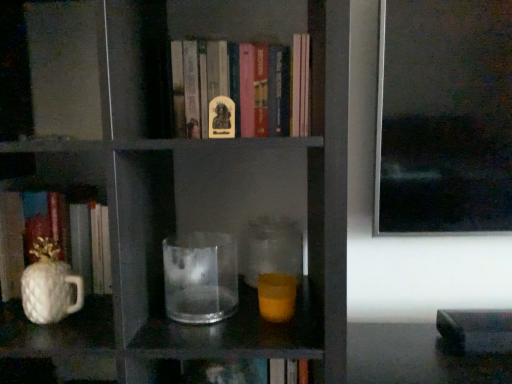
This screenshot has height=384, width=512. Describe the element at coordinates (272, 249) in the screenshot. I see `transparent glass jar at center` at that location.

At what (x,y) coordinates should I click in order to perform the action: click on transparent glass at center. Please return your answer as a coordinate pair (x, y). Looking at the image, I should click on (200, 277).

Where is `white glossy pineapple-shaped mug at left`? This screenshot has width=512, height=384. white glossy pineapple-shaped mug at left is located at coordinates (49, 285).

Image resolution: width=512 pixels, height=384 pixels. I want to click on translucent glass candle at center, so click(277, 296).

Considering the sizes of objects transparent glass at center and hardcover book at center, the second book in the left-to-right sequence, in the image provided, who is shorter, transparent glass at center or hardcover book at center, the second book in the left-to-right sequence,?

transparent glass at center.

Relative to hardcover book at center, the second book in the left-to-right sequence, is transparent glass at center in front or behind?

Visually, transparent glass at center is located in front of hardcover book at center, the second book in the left-to-right sequence.

Is transparent glass at center facing away from hardcover book at center, the second book in the left-to-right sequence?

No, transparent glass at center is not facing the opposite direction of hardcover book at center, the second book in the left-to-right sequence.

Is point (59, 218) closer to viewer compared to point (177, 308)?

No.

In the image, is white glossy pineapple-shaped object at left, which is counted as the second book, starting from the right, on the left side or the right side of transparent glass at center?

Clearly, white glossy pineapple-shaped object at left, which is counted as the second book, starting from the right, is on the left of transparent glass at center in the image.

Considering the sizes of objects white glossy pineapple-shaped object at left, which is counted as the 2th book, starting from the top, and transparent glass at center in the image provided, who is thinner, white glossy pineapple-shaped object at left, which is counted as the 2th book, starting from the top, or transparent glass at center?

With smaller width is transparent glass at center.

From the image's perspective, which book is the 1st one above the transparent glass jar at center? Please provide its 2D coordinates.

[(28, 232)]

From a real-world perspective, is white glossy pineapple-shaped object at left, the 1th book viewed from the left, above or below transparent glass jar at center?

In terms of real-world spatial position, white glossy pineapple-shaped object at left, the 1th book viewed from the left, is above transparent glass jar at center.

Is white glossy pineapple-shaped object at left, marked as the first book in a bottom-to-top arrangement, situated inside transparent glass jar at center or outside?

white glossy pineapple-shaped object at left, marked as the first book in a bottom-to-top arrangement, exists outside the volume of transparent glass jar at center.

Which object is wider, white glossy pineapple-shaped object at left, marked as the first book in a bottom-to-top arrangement, or transparent glass jar at center?

With larger width is white glossy pineapple-shaped object at left, marked as the first book in a bottom-to-top arrangement.

Which object is closer to the camera taking this photo, hardcover book at center, the second book in the left-to-right sequence, or white glossy pineapple-shaped object at left, which is counted as the second book, starting from the right?

hardcover book at center, the second book in the left-to-right sequence.

Can you confirm if hardcover book at center, marked as the 2th book in a bottom-to-top arrangement, is bigger than white glossy pineapple-shaped object at left, the 1th book viewed from the left?

Yes, hardcover book at center, marked as the 2th book in a bottom-to-top arrangement, is bigger than white glossy pineapple-shaped object at left, the 1th book viewed from the left.

Is hardcover book at center, the second book in the left-to-right sequence, aimed at white glossy pineapple-shaped object at left, which is counted as the second book, starting from the right?

No, hardcover book at center, the second book in the left-to-right sequence, is not oriented towards white glossy pineapple-shaped object at left, which is counted as the second book, starting from the right.

Is translucent glass candle at center facing towards white glossy pineapple-shaped mug at left?

No, translucent glass candle at center is not facing towards white glossy pineapple-shaped mug at left.

Is translucent glass candle at center to the left of white glossy pineapple-shaped mug at left from the viewer's perspective?

In fact, translucent glass candle at center is to the right of white glossy pineapple-shaped mug at left.

Who is smaller, translucent glass candle at center or white glossy pineapple-shaped mug at left?

Smaller between the two is translucent glass candle at center.

Is translucent glass candle at center inside the boundaries of white glossy pineapple-shaped mug at left, or outside?

The correct answer is: outside.

Is hardcover book at center, the second book in the left-to-right sequence, facing away from transparent glass jar at center?

hardcover book at center, the second book in the left-to-right sequence, is not turned away from transparent glass jar at center.

Which of these two, hardcover book at center, the second book in the left-to-right sequence, or transparent glass jar at center, stands taller?

Standing taller between the two is hardcover book at center, the second book in the left-to-right sequence.

The width and height of the screenshot is (512, 384). What are the coordinates of `glass jar located behind the hardcover book at center, the second book in the left-to-right sequence` in the screenshot? It's located at (272, 249).

Considering the positions of objects hardcover book at center, the 1th book viewed from the top, and transparent glass jar at center in the image provided, who is more to the right, hardcover book at center, the 1th book viewed from the top, or transparent glass jar at center?

From the viewer's perspective, transparent glass jar at center appears more on the right side.

Looking at this image, from the image's perspective, which object appears higher, white glossy pineapple-shaped mug at left or white glossy pineapple-shaped object at left, which is counted as the second book, starting from the right?

white glossy pineapple-shaped object at left, which is counted as the second book, starting from the right, appears higher in the image.

How many degrees apart are the facing directions of white glossy pineapple-shaped mug at left and white glossy pineapple-shaped object at left, the 1th book viewed from the left?

The angle between the facing direction of white glossy pineapple-shaped mug at left and the facing direction of white glossy pineapple-shaped object at left, the 1th book viewed from the left, is 0.000394 degrees.

The width and height of the screenshot is (512, 384). In order to click on book on the left of white glossy pineapple-shaped mug at left in this screenshot , I will do `click(28, 232)`.

Can you confirm if white glossy pineapple-shaped mug at left is smaller than white glossy pineapple-shaped object at left, which is counted as the second book, starting from the right?

Yes.

Find the location of `jug in front of the hardcover book at center, positioned as the 1th book in right-to-left order`. jug in front of the hardcover book at center, positioned as the 1th book in right-to-left order is located at coordinates (200, 277).

This screenshot has height=384, width=512. What are the coordinates of `jug lying below the white glossy pineapple-shaped object at left, which is counted as the second book, starting from the right (from the image's perspective)` in the screenshot? It's located at (200, 277).

Based on their spatial positions, is transparent glass at center or hardcover book at center, marked as the 2th book in a bottom-to-top arrangement, closer to transparent glass jar at center?

Among the two, transparent glass at center is located nearer to transparent glass jar at center.

Considering their positions, is translucent glass candle at center positioned closer to transparent glass jar at center than white glossy pineapple-shaped mug at left?

The object closer to transparent glass jar at center is translucent glass candle at center.

Which object lies further to the anchor point white glossy pineapple-shaped mug at left, transparent glass jar at center or white glossy pineapple-shaped object at left, the 1th book viewed from the left?

transparent glass jar at center lies further to white glossy pineapple-shaped mug at left than the other object.

In the scene shown: When comparing their distances from transparent glass jar at center, does white glossy pineapple-shaped mug at left or hardcover book at center, positioned as the 1th book in right-to-left order, seem further?

white glossy pineapple-shaped mug at left is positioned further to the anchor transparent glass jar at center.

Considering their positions, is translucent glass candle at center positioned closer to transparent glass at center than hardcover book at center, the second book in the left-to-right sequence?

Based on the image, translucent glass candle at center appears to be nearer to transparent glass at center.

Looking at the image, which one is located closer to hardcover book at center, the second book in the left-to-right sequence, white glossy pineapple-shaped object at left, marked as the first book in a bottom-to-top arrangement, or translucent glass candle at center?

The object closer to hardcover book at center, the second book in the left-to-right sequence, is translucent glass candle at center.

When comparing their distances from transparent glass jar at center, does hardcover book at center, the 1th book viewed from the top, or white glossy pineapple-shaped object at left, marked as the first book in a bottom-to-top arrangement, seem further?

white glossy pineapple-shaped object at left, marked as the first book in a bottom-to-top arrangement, is further to transparent glass jar at center.

Estimate the real-world distances between objects in this image. Which object is further from white glossy pineapple-shaped mug at left, hardcover book at center, positioned as the 1th book in right-to-left order, or white glossy pineapple-shaped object at left, the 1th book viewed from the left?

Based on the image, hardcover book at center, positioned as the 1th book in right-to-left order, appears to be further to white glossy pineapple-shaped mug at left.

Where is `candle holder between white glossy pineapple-shaped object at left, which is counted as the 2th book, starting from the top, and transparent glass jar at center`? candle holder between white glossy pineapple-shaped object at left, which is counted as the 2th book, starting from the top, and transparent glass jar at center is located at coordinates (277, 296).

Locate an element on the screen. glass jar between hardcover book at center, marked as the 2th book in a bottom-to-top arrangement, and translucent glass candle at center from top to bottom is located at coordinates (272, 249).

The width and height of the screenshot is (512, 384). In order to click on glass vase between white glossy pineapple-shaped object at left, which is counted as the second book, starting from the right, and transparent glass at center in this screenshot , I will do [49, 285].

What are the coordinates of `glass vase between hardcover book at center, the second book in the left-to-right sequence, and translucent glass candle at center vertically` in the screenshot? It's located at (49, 285).